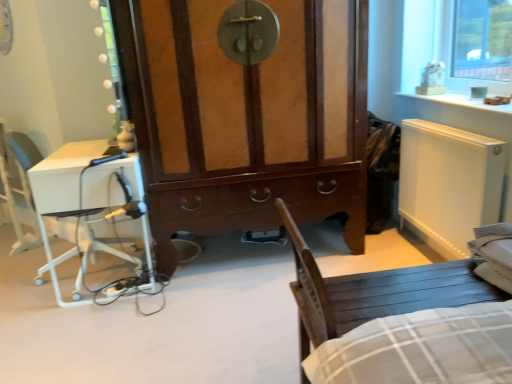
What do you see at coordinates (448, 184) in the screenshot?
I see `white matte radiator at right` at bounding box center [448, 184].

Image resolution: width=512 pixels, height=384 pixels. What are the coordinates of `white matte radiator at right` in the screenshot? It's located at (448, 184).

What is the approximate width of brown wood cabinet at center?

The width of brown wood cabinet at center is 28.01 inches.

Describe the element at coordinates (80, 187) in the screenshot. Image resolution: width=512 pixels, height=384 pixels. I see `white glossy desk at left` at that location.

Locate an element on the screen. white matte radiator at right is located at coordinates (448, 184).

Considering the sizes of objects brown wood cabinet at center and white glossy desk at left in the image provided, who is smaller, brown wood cabinet at center or white glossy desk at left?

white glossy desk at left.

Who is shorter, brown wood cabinet at center or white glossy desk at left?

white glossy desk at left.

Which object is wider, brown wood cabinet at center or white glossy desk at left?

Wider between the two is brown wood cabinet at center.

Is brown wood cabinet at center not near white plastic armchair at left?

brown wood cabinet at center is positioned a significant distance from white plastic armchair at left.

Can you confirm if brown wood cabinet at center is thinner than white plastic armchair at left?

In fact, brown wood cabinet at center might be wider than white plastic armchair at left.

From a real-world perspective, is brown wood cabinet at center physically located above or below white plastic armchair at left?

Clearly, from a real-world perspective, brown wood cabinet at center is above white plastic armchair at left.

Could you tell me if brown wood cabinet at center is facing white plastic armchair at left?

No, brown wood cabinet at center is not facing towards white plastic armchair at left.

Which point is more distant from viewer, (x=24, y=234) or (x=489, y=166)?

The point (x=24, y=234) is more distant.

Which object is closer to the camera taking this photo, white plastic armchair at left or white matte radiator at right?

white matte radiator at right.

Would you say white plastic armchair at left is a long distance from white matte radiator at right?

Absolutely, white plastic armchair at left is distant from white matte radiator at right.

Is white plastic armchair at left taller or shorter than white matte radiator at right?

Clearly, white plastic armchair at left is taller compared to white matte radiator at right.

At what (x,y) coordinates should I click in order to perform the action: click on chair that is in front of the white plastic armchair at left. Please return your answer as a coordinate pair (x, y). The width and height of the screenshot is (512, 384). Looking at the image, I should click on (374, 291).

Is wooden chair at lower right further to camera compared to white plastic armchair at left?

No, the depth of wooden chair at lower right is less than that of white plastic armchair at left.

Does point (367, 288) lie behind point (21, 234)?

That is False.

Is wooden chair at lower right located outside white plastic armchair at left?

wooden chair at lower right lies outside white plastic armchair at left's area.

Does point (172, 27) appear closer or farther from the camera than point (483, 216)?

Point (172, 27) appears to be farther away from the viewer than point (483, 216).

Looking at this image, can you tell me how much brown wood cabinet at center and white matte radiator at right differ in facing direction?

They differ by 89.3 degrees in their facing directions.

Which object is positioned more to the right, brown wood cabinet at center or white matte radiator at right?

white matte radiator at right.

Is brown wood cabinet at center wider than white matte radiator at right?

Indeed, brown wood cabinet at center has a greater width compared to white matte radiator at right.

Does point (108, 167) lie in front of point (434, 282)?

No.

Is white glossy desk at left directly adjacent to wooden chair at lower right?

white glossy desk at left is not next to wooden chair at lower right, and they're not touching.

From a real-world perspective, which object stands above the other?

wooden chair at lower right is physically above.

Which of these two, white glossy desk at left or wooden chair at lower right, is smaller?

white glossy desk at left is smaller.

Find the location of a particular element. desk behind the white matte radiator at right is located at coordinates (80, 187).

Are white glossy desk at left and white matte radiator at right located far from each other?

Yes, white glossy desk at left is far from white matte radiator at right.

Which of these two, white glossy desk at left or white matte radiator at right, is bigger?

white glossy desk at left is bigger.

Could you tell me if white glossy desk at left is facing white matte radiator at right?

No, white glossy desk at left does not turn towards white matte radiator at right.

Find the location of a particular element. This screenshot has height=384, width=512. desk below the brown wood cabinet at center (from a real-world perspective) is located at coordinates (80, 187).

Locate an element on the screen. armchair that is on the left side of brown wood cabinet at center is located at coordinates (19, 185).

Based on their spatial positions, is brown wood cabinet at center or wooden chair at lower right further from white plastic armchair at left?

wooden chair at lower right lies further to white plastic armchair at left than the other object.

Based on their spatial positions, is wooden chair at lower right or white plastic armchair at left further from white matte radiator at right?

white plastic armchair at left is further to white matte radiator at right.

Considering their positions, is white plastic armchair at left positioned further to white glossy desk at left than wooden chair at lower right?

wooden chair at lower right.

In the scene shown: Considering their positions, is white matte radiator at right positioned further to wooden chair at lower right than brown wood cabinet at center?

Based on the image, brown wood cabinet at center appears to be further to wooden chair at lower right.

Which object lies nearer to the anchor point brown wood cabinet at center, wooden chair at lower right or white glossy desk at left?

white glossy desk at left.

Looking at the image, which one is located closer to brown wood cabinet at center, white glossy desk at left or white matte radiator at right?

white glossy desk at left is positioned closer to the anchor brown wood cabinet at center.

From the picture: Looking at the image, which one is located closer to white glossy desk at left, white matte radiator at right or white plastic armchair at left?

white plastic armchair at left is positioned closer to the anchor white glossy desk at left.

Considering their positions, is white matte radiator at right positioned closer to white plastic armchair at left than brown wood cabinet at center?

Among the two, brown wood cabinet at center is located nearer to white plastic armchair at left.

The width and height of the screenshot is (512, 384). Identify the location of desk between white plastic armchair at left and white matte radiator at right. (80, 187).

Locate an element on the screen. chair located between white glossy desk at left and white matte radiator at right in the left-right direction is located at coordinates (374, 291).

This screenshot has height=384, width=512. I want to click on desk between white plastic armchair at left and brown wood cabinet at center, so click(x=80, y=187).

You are a GUI agent. You are given a task and a screenshot of the screen. Output one action in this format:
    pyautogui.click(x=<x>, y=<y>)
    Task: Click on the cabinetry between white plastic armchair at left and wooden chair at lower right from left to right
    The width and height of the screenshot is (512, 384).
    Given the screenshot: What is the action you would take?
    pyautogui.click(x=246, y=118)